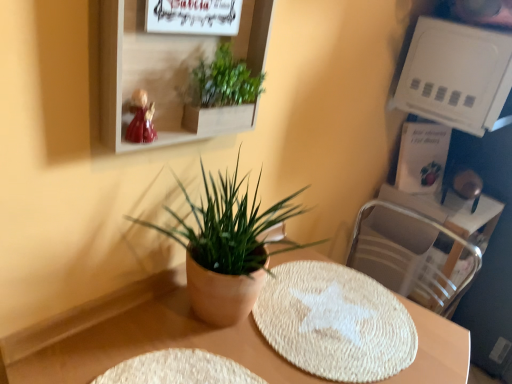
Question: Is white plastic shelf at upper right, which is counted as the first shelf, starting from the back, in front of or behind green leafy plant at upper center, which appears as the 2th houseplant when ordered from the bottom, in the image?

Choices:
 (A) behind
 (B) front

Answer: (A)

Question: Would you say white plastic shelf at upper right, which ranks as the 1th shelf in right-to-left order, is to the left or to the right of green leafy plant at upper center, which appears as the 2th houseplant when ordered from the bottom, in the picture?

Choices:
 (A) right
 (B) left

Answer: (A)

Question: Estimate the real-world distances between objects in this image. Which object is farther from the beige woven placemat at center?

Choices:
 (A) matte white shelf at upper center, which appears as the second shelf when viewed from the back
 (B) white plastic shelf at upper right, which ranks as the 2th shelf in front-to-back order
 (C) green leafy plant at upper center, which appears as the 1th houseplant when viewed from the top
 (D) green matte plant at center, which ranks as the first houseplant in bottom-to-top order
 (E) metallic silver swivel chair at right

Answer: (B)

Question: Considering the real-world distances, which object is closest to the white woven mat at center?

Choices:
 (A) matte white shelf at upper center, the first shelf when ordered from left to right
 (B) green leafy plant at upper center, which appears as the 1th houseplant when viewed from the top
 (C) green matte plant at center, arranged as the 2th houseplant when viewed from the top
 (D) metallic silver swivel chair at right
 (E) white plastic shelf at upper right, which ranks as the 2th shelf in front-to-back order

Answer: (C)